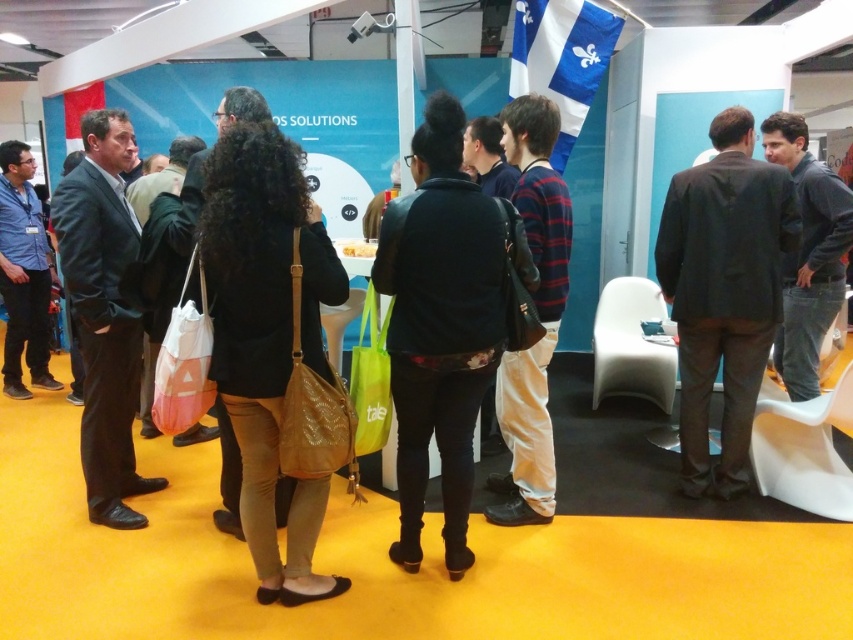
You are standing at the entrance of the booth and want to reach both the point at coordinates point (442, 392) and the point at coordinates point (737, 385). Which point should you reach first to follow the shortest path?

You should reach the point at coordinates point (442, 392) first because it is closer to you than the point at coordinates point (737, 385).

You are a photographer at the event and need to capture both the dark blue jacket at center and the dark brown suit at center in a single frame. Which object should you focus on first to ensure both are in the frame without moving the camera?

You should focus on the dark brown suit at center first because it is larger than the dark blue jacket at center, allowing the smaller jacket to fit into the frame more easily.

You are an event planner at the trade show and need to adjust the display items. The dark blue jacket at center and dark brown suit at center are currently displayed in a way that might block each other. Which item is placed lower and needs to be adjusted to avoid obstruction?

The dark blue jacket at center is positioned under the dark brown suit at center, so the dark blue jacket at center is placed lower and needs to be adjusted to avoid obstruction.